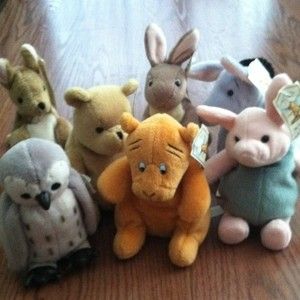
The height and width of the screenshot is (300, 300). I want to click on stuffies, so click(x=35, y=125), click(x=107, y=131), click(x=44, y=186), click(x=165, y=90), click(x=237, y=95), click(x=249, y=153), click(x=157, y=163).